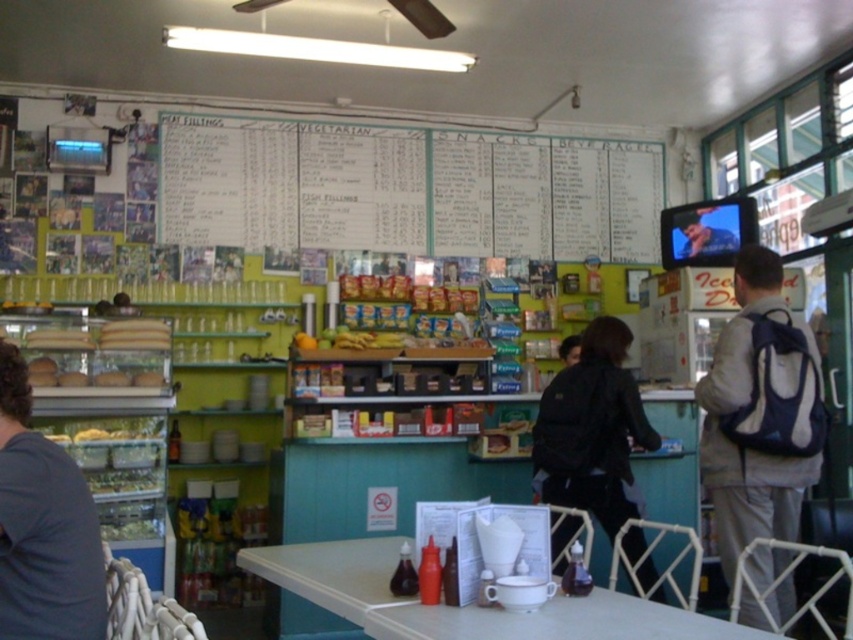
Question: Where is gray fabric backpack at right located in relation to black backpack at center in the image?

Choices:
 (A) above
 (B) below

Answer: (A)

Question: Which point is closer to the camera taking this photo?

Choices:
 (A) (102, 612)
 (B) (564, 406)
 (C) (717, 529)

Answer: (A)

Question: In this image, where is white plastic table at center located relative to black backpack at center?

Choices:
 (A) left
 (B) right

Answer: (A)

Question: Which of the following is the farthest from the observer?

Choices:
 (A) (612, 356)
 (B) (410, 147)

Answer: (B)

Question: Considering the real-world distances, which object is closest to the dark gray shirt at left?

Choices:
 (A) gray fabric backpack at right
 (B) white plastic table at center
 (C) black backpack at center
 (D) white paperboard at upper center

Answer: (B)

Question: Can you confirm if gray fabric backpack at right is positioned above black backpack at center?

Choices:
 (A) no
 (B) yes

Answer: (B)